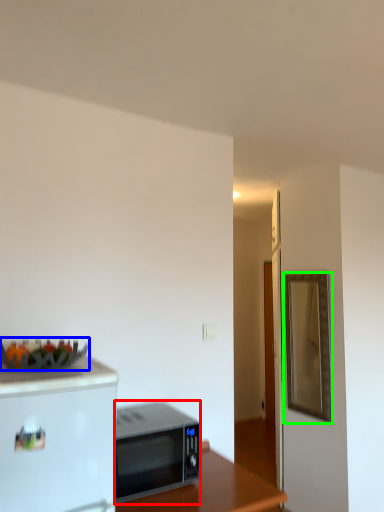
Question: Estimate the real-world distances between objects in this image. Which object is farther from microwave oven (highlighted by a red box), food (highlighted by a blue box) or mirror (highlighted by a green box)?

Choices:
 (A) food
 (B) mirror

Answer: (B)